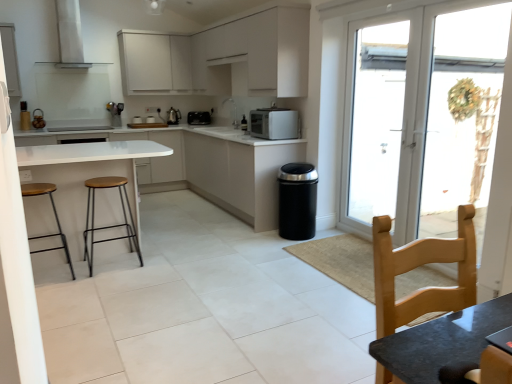
Where is `vacant area that is situated to the right of wooden seat and metal frame stool at left, which is counted as the 1th stool, starting from the right`? vacant area that is situated to the right of wooden seat and metal frame stool at left, which is counted as the 1th stool, starting from the right is located at coordinates (161, 261).